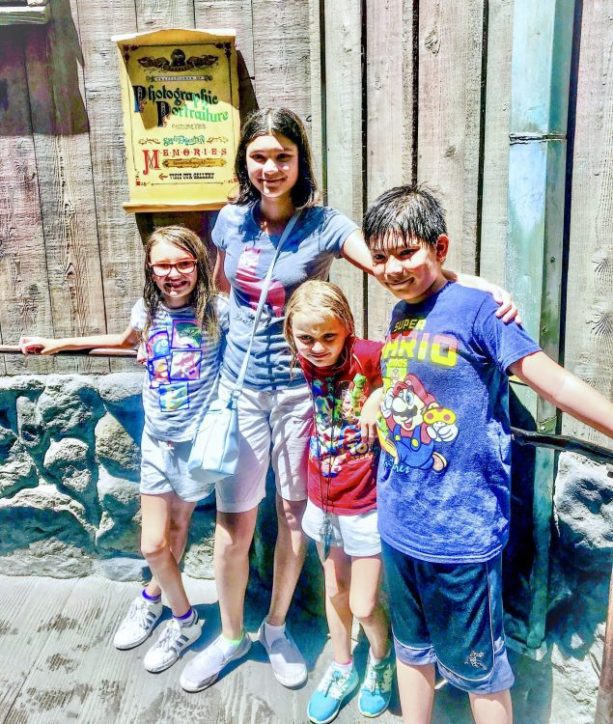
Locate an element on the screen. This screenshot has width=613, height=724. floor is located at coordinates (97, 681).